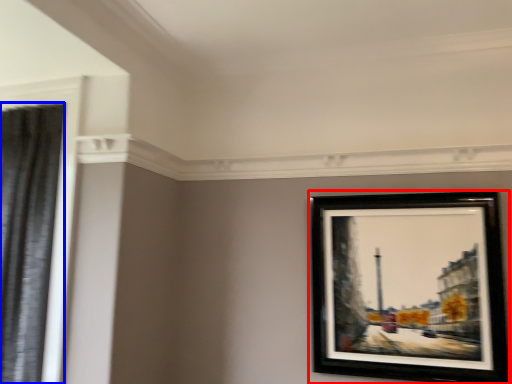
Question: Which point is further to the camera, picture frame (highlighted by a red box) or shower curtain (highlighted by a blue box)?

Choices:
 (A) picture frame
 (B) shower curtain

Answer: (A)